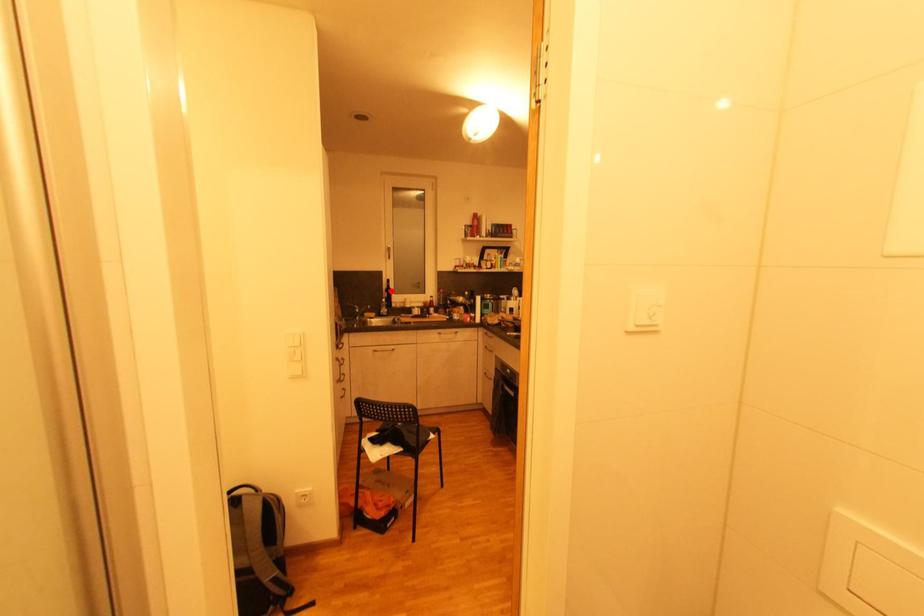
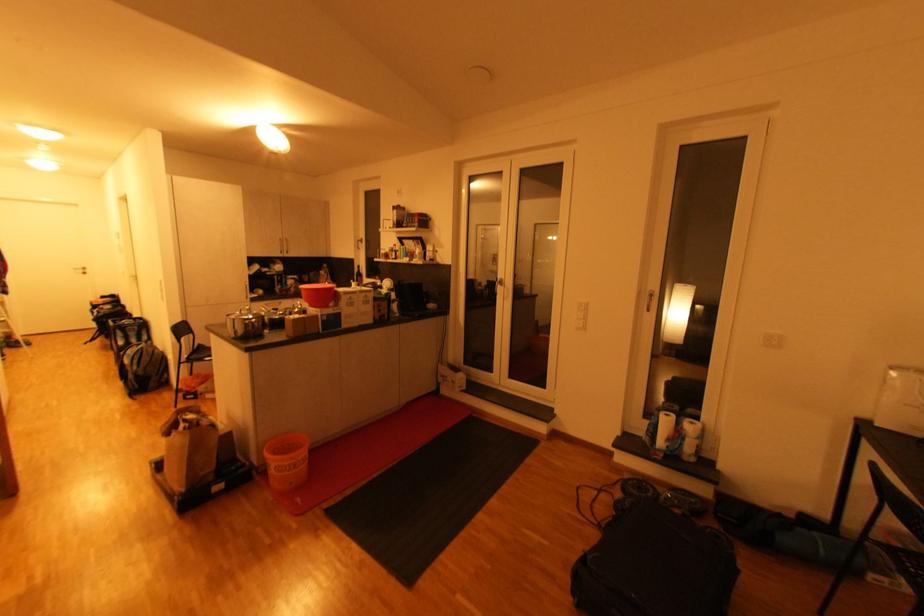
The point at the highlighted location is marked in the first image. Where is the corresponding point in the second image?

(361, 275)